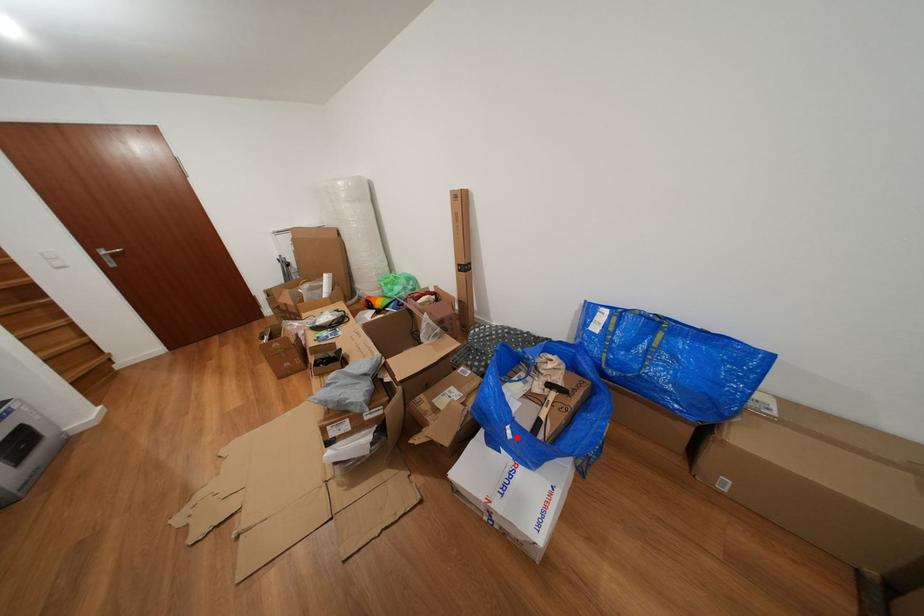
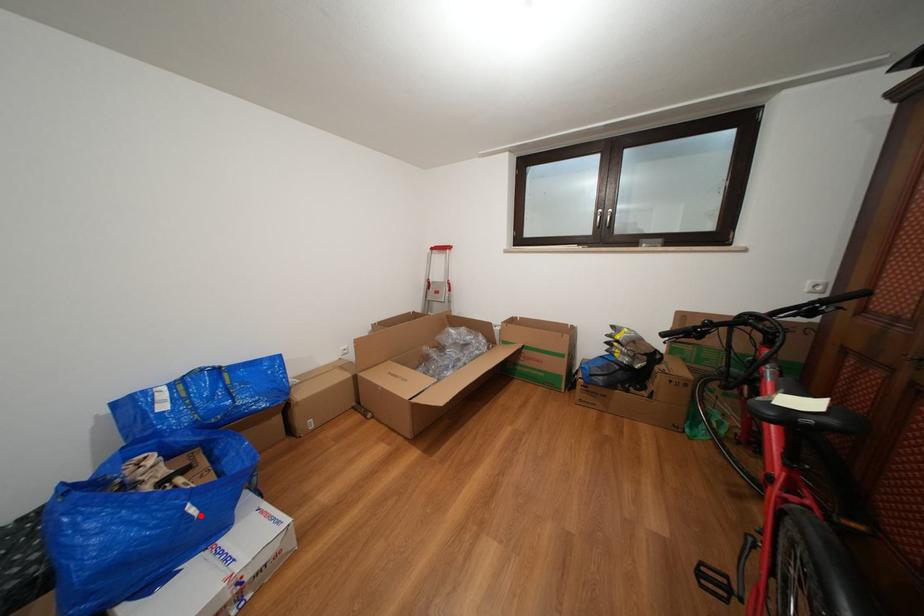
I am providing you with two images of the same scene from different viewpoints. A red point is marked on the first image and another point is marked on the second image. Are the points marked in image1 and image2 representing the same 3D position?

Yes